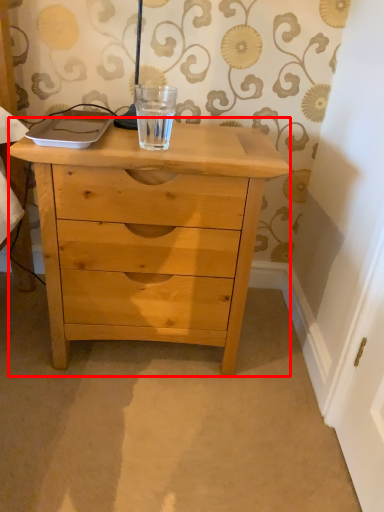
Question: Considering the relative positions of chest of drawers (annotated by the red box) and beverage in the image provided, where is chest of drawers (annotated by the red box) located with respect to the staircase?

Choices:
 (A) left
 (B) right

Answer: (A)